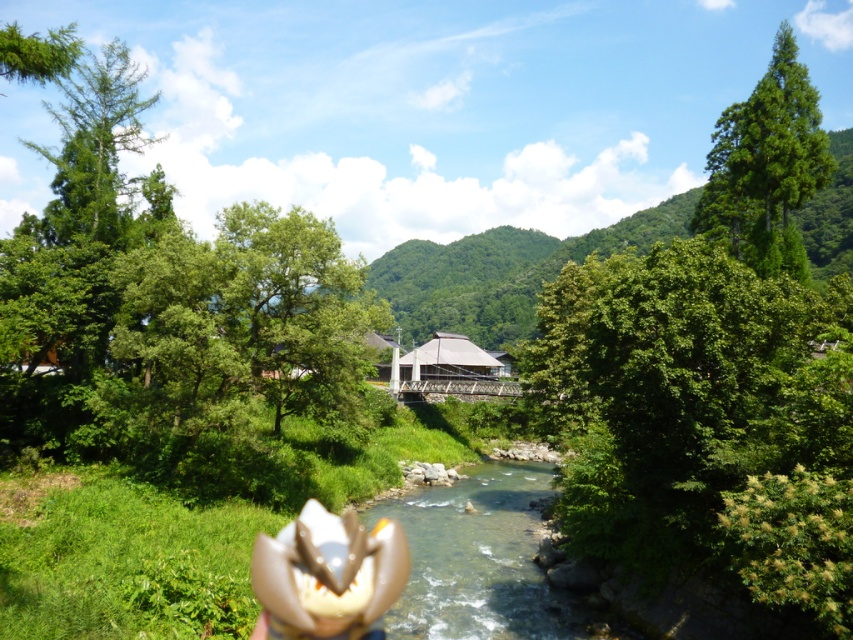
You are a hiker who wants to take a photo of both the green leafy tree at center and the white matte flower at center. Since you have a camera with a fixed focal length, you need to know which object is bigger to adjust the focus. Which one should you focus on first?

The green leafy tree at center is larger in size than the white matte flower at center, so you should focus on the green leafy tree at center first to ensure it is in clear view.

Consider the image. You are standing at the point labeled point (242, 243) and want to walk to the point labeled point (331, 614). Which direction should you move in to get closer to your destination?

You should move towards the right and away from the viewer since point (242, 243) is closer to the viewer than point (331, 614).

You are standing at the point marked as point (479, 560) in the image. What do you see directly below you?

You see clear water at center directly below point (479, 560).